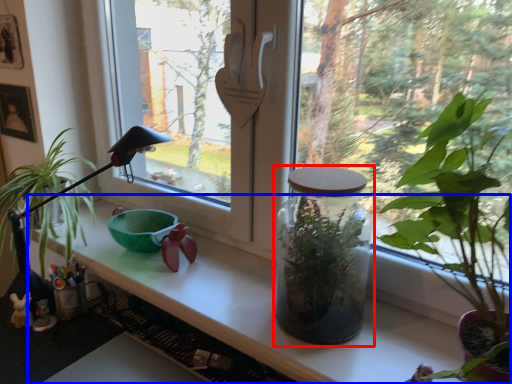
Question: Which object appears closest to the camera in this image, glass jar (highlighted by a red box) or counter top (highlighted by a blue box)?

Choices:
 (A) glass jar
 (B) counter top

Answer: (B)